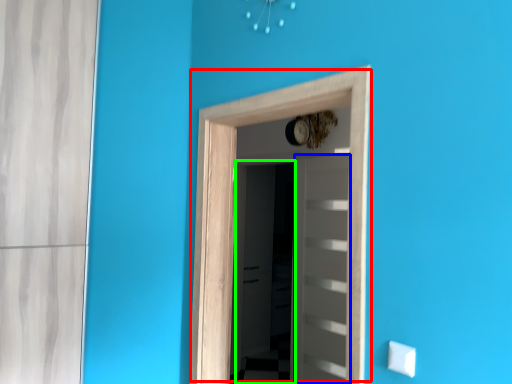
Question: Which object is the farthest from door (highlighted by a red box)? Choose among these: door (highlighted by a blue box) or screen door (highlighted by a green box).

Choices:
 (A) door
 (B) screen door

Answer: (B)